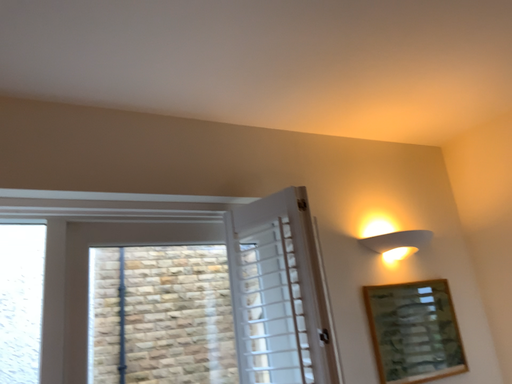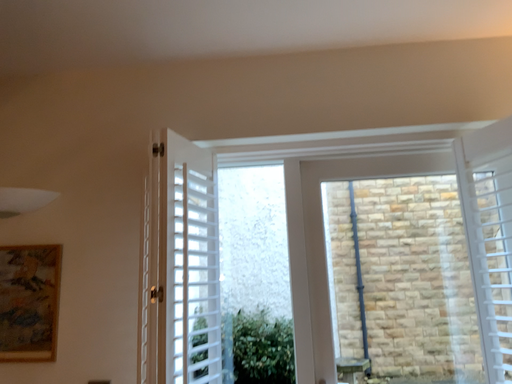
Question: Which way did the camera rotate in the video?

Choices:
 (A) rotated downward
 (B) rotated upward

Answer: (A)